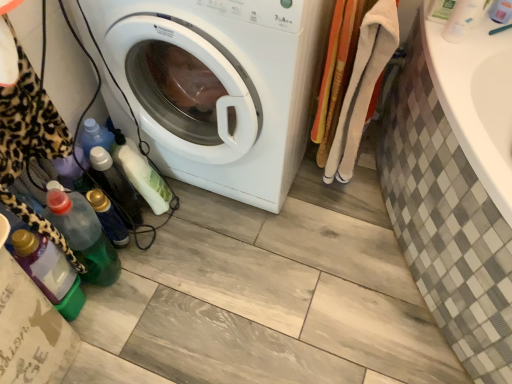
Question: Considering the relative sizes of white plastic bottle at upper right and soft cotton towels at right in the image provided, is white plastic bottle at upper right smaller than soft cotton towels at right?

Choices:
 (A) no
 (B) yes

Answer: (B)

Question: Considering the relative positions of white plastic bottle at upper right and soft cotton towels at right in the image provided, is white plastic bottle at upper right to the left of soft cotton towels at right from the viewer's perspective?

Choices:
 (A) no
 (B) yes

Answer: (A)

Question: Does white plastic bottle at upper right have a greater width compared to soft cotton towels at right?

Choices:
 (A) yes
 (B) no

Answer: (B)

Question: Is white plastic bottle at upper right in contact with soft cotton towels at right?

Choices:
 (A) no
 (B) yes

Answer: (A)

Question: Is white plastic bottle at upper right outside soft cotton towels at right?

Choices:
 (A) no
 (B) yes

Answer: (B)

Question: From the image's perspective, does white plastic bottle at upper right appear higher than soft cotton towels at right?

Choices:
 (A) no
 (B) yes

Answer: (B)

Question: Is translucent plastic bottle at lower left, the 1th bottle from the left, smaller than soft cotton towels at right?

Choices:
 (A) yes
 (B) no

Answer: (A)

Question: From a real-world perspective, does translucent plastic bottle at lower left, the 7th bottle positioned from the right, sit lower than soft cotton towels at right?

Choices:
 (A) yes
 (B) no

Answer: (A)

Question: Does translucent plastic bottle at lower left, the 1th bottle from the left, have a larger size compared to soft cotton towels at right?

Choices:
 (A) no
 (B) yes

Answer: (A)

Question: From the image's perspective, is translucent plastic bottle at lower left, the 1th bottle from the left, located beneath soft cotton towels at right?

Choices:
 (A) no
 (B) yes

Answer: (B)

Question: Is translucent plastic bottle at lower left, the 7th bottle positioned from the right, at the right side of soft cotton towels at right?

Choices:
 (A) yes
 (B) no

Answer: (B)

Question: Is translucent plastic bottle at lower left, the 7th bottle positioned from the right, behind soft cotton towels at right?

Choices:
 (A) no
 (B) yes

Answer: (B)